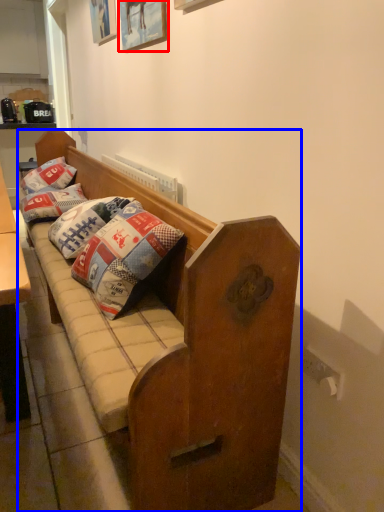
Question: Which object appears farthest to the camera in this image, picture frame (highlighted by a red box) or studio couch (highlighted by a blue box)?

Choices:
 (A) picture frame
 (B) studio couch

Answer: (A)